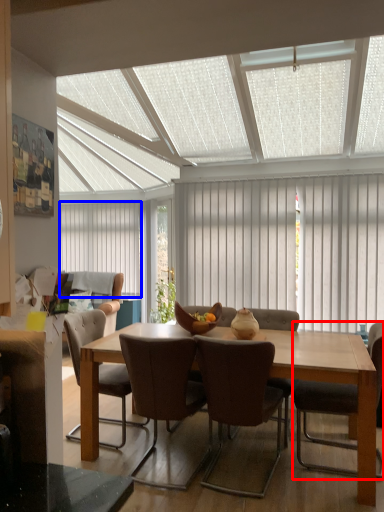
Question: Which object is further to the camera taking this photo, chair (highlighted by a red box) or curtain (highlighted by a blue box)?

Choices:
 (A) chair
 (B) curtain

Answer: (B)